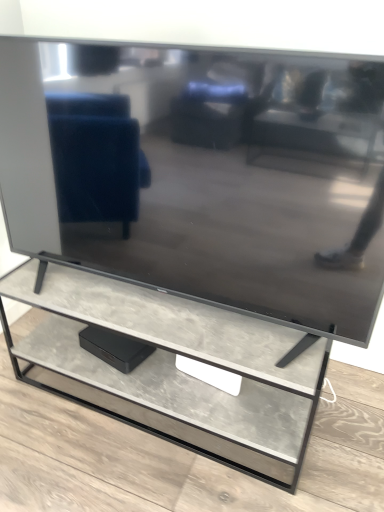
Describe the element at coordinates (175, 368) in the screenshot. I see `concrete/marble cabinet at center` at that location.

The image size is (384, 512). I want to click on concrete/marble cabinet at center, so click(175, 368).

I want to click on concrete/marble cabinet at center, so click(175, 368).